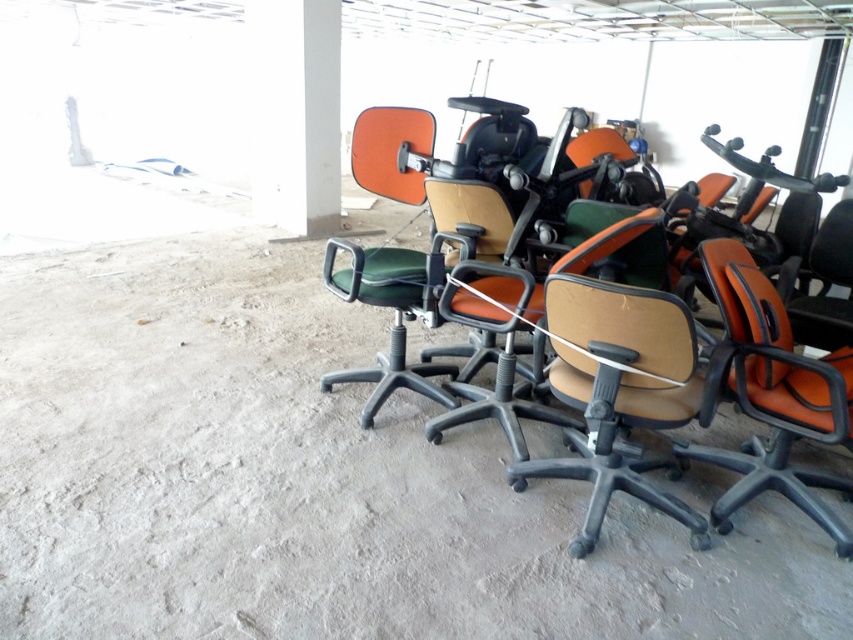
Is point (827, 406) positioned behind point (444, 372)?

That is False.

This screenshot has width=853, height=640. I want to click on orange leather swivel chair at center, so (775, 396).

The width and height of the screenshot is (853, 640). In order to click on orange leather swivel chair at center in this screenshot , I will do `click(775, 396)`.

Does brown fabric office chair at center have a lesser width compared to beige fabric swivel chair at center?

No.

Between brown fabric office chair at center and beige fabric swivel chair at center, which one has less height?

beige fabric swivel chair at center

Which is in front, point (740, 368) or point (640, 364)?

Positioned in front is point (640, 364).

This screenshot has height=640, width=853. I want to click on brown fabric office chair at center, so click(x=683, y=376).

Does brown fabric office chair at center have a smaller size compared to green fabric office chair at center?

Actually, brown fabric office chair at center might be larger than green fabric office chair at center.

From the picture: Can you confirm if brown fabric office chair at center is positioned to the right of green fabric office chair at center?

Indeed, brown fabric office chair at center is positioned on the right side of green fabric office chair at center.

Find the location of a particular element. This screenshot has height=640, width=853. brown fabric office chair at center is located at coordinates (683, 376).